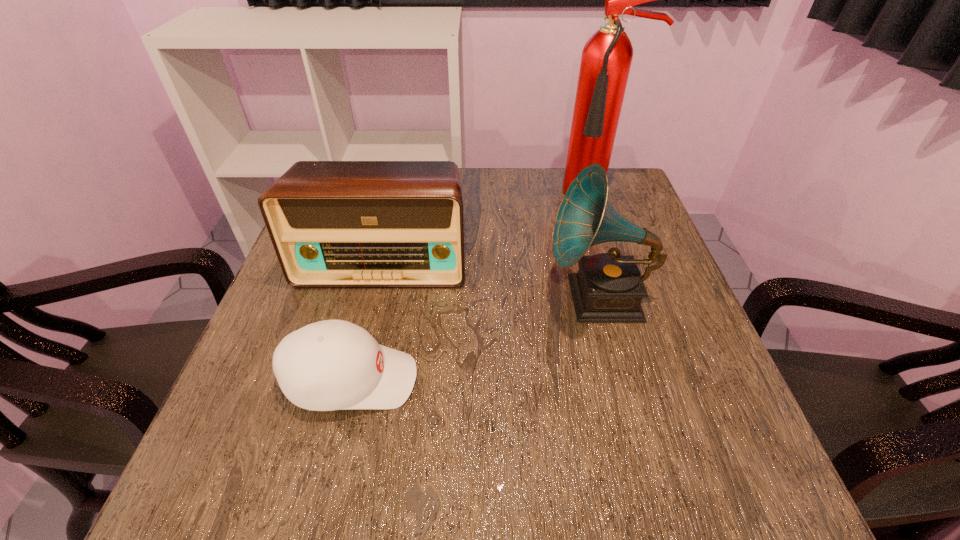
Identify the location of free spot that satisfies the following two spatial constraints: 1. at the nozzle of the tallest object; 2. from the horn of the phonograph_record. (632, 298).